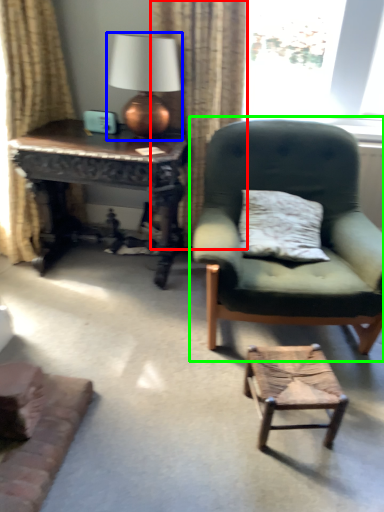
Question: Estimate the real-world distances between objects in this image. Which object is closer to curtain (highlighted by a red box), table lamp (highlighted by a blue box) or chair (highlighted by a green box)?

Choices:
 (A) table lamp
 (B) chair

Answer: (A)